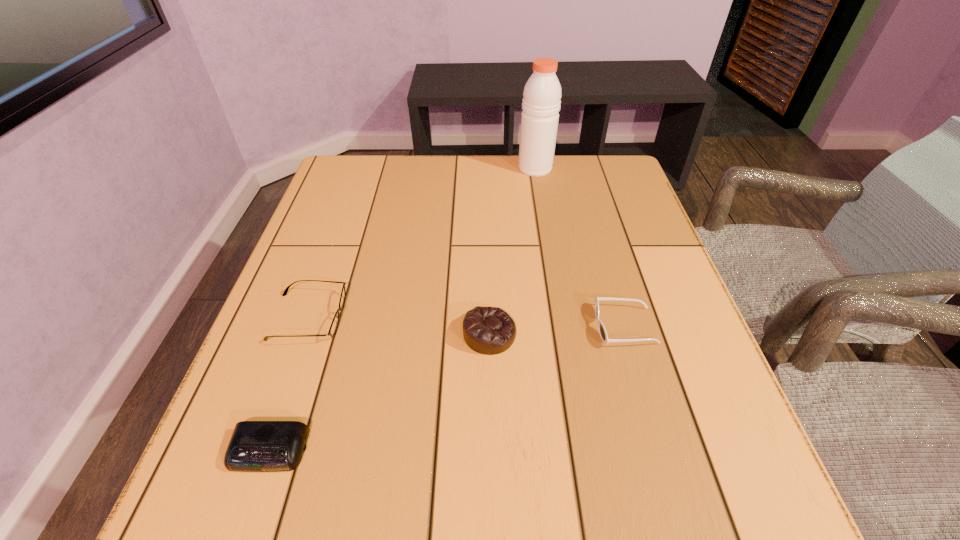
The width and height of the screenshot is (960, 540). I want to click on empty space that is in between the alarm clock and the spectacles, so click(x=289, y=384).

At what (x,y) coordinates should I click in order to perform the action: click on free space between the tallest object and the spectacles. Please return your answer as a coordinate pair (x, y). Looking at the image, I should click on (421, 242).

Where is `empty location between the alarm clock and the third object from right to left`? This screenshot has height=540, width=960. empty location between the alarm clock and the third object from right to left is located at coordinates (379, 392).

Where is `blank region between the second object from right to left and the fourth shortest object`? Image resolution: width=960 pixels, height=540 pixels. blank region between the second object from right to left and the fourth shortest object is located at coordinates (513, 251).

In order to click on vacant space that's between the sunglasses and the tallest object in this screenshot , I will do (580, 247).

Point out which object is positioned as the third nearest to the spectacles. Please provide its 2D coordinates. Your answer should be formatted as a tuple, i.e. [(x, y)], where the tuple contains the x and y coordinates of a point satisfying the conditions above.

[(602, 331)]

Locate which object is the closest to the farthest object. Please provide its 2D coordinates. Your answer should be formatted as a tuple, i.e. [(x, y)], where the tuple contains the x and y coordinates of a point satisfying the conditions above.

[(602, 331)]

Locate an element on the screen. blank area in the image that satisfies the following two spatial constraints: 1. with the lenses of the sunglasses facing outward; 2. on the display of the nearest object is located at coordinates (660, 450).

Where is `free point that satisfies the following two spatial constraints: 1. on the front-facing side of the third object from right to left; 2. on the right side of the spectacles`? This screenshot has width=960, height=540. free point that satisfies the following two spatial constraints: 1. on the front-facing side of the third object from right to left; 2. on the right side of the spectacles is located at coordinates (302, 334).